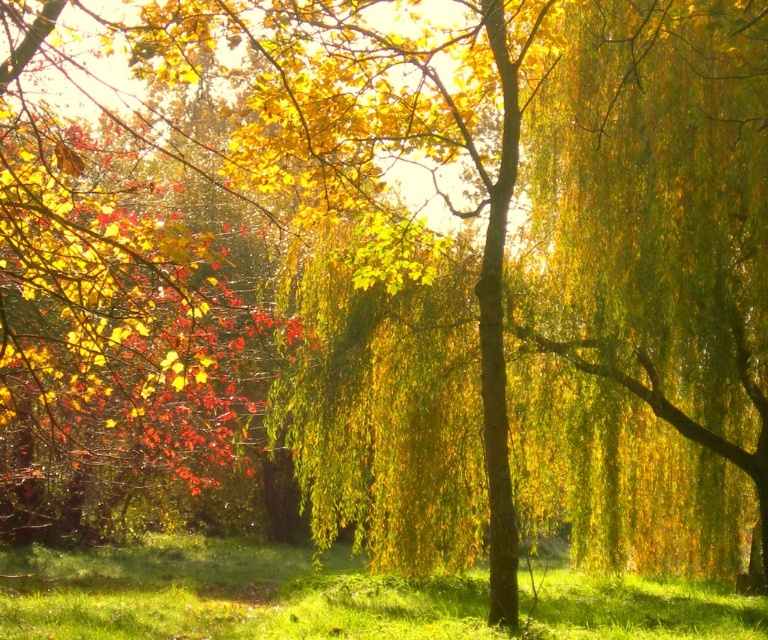
You are standing in the park scene described. There is a point marked at coordinates (666, 214). Which object in the scene does this point correspond to?

The point at coordinates (666, 214) corresponds to the golden silky willow at right.

You are standing in the park and want to take a photo of the golden silky willow at right and the green grass at lower center. Which object should you focus on first if you want both to be in sharp focus?

You should focus on the golden silky willow at right first because it is closer to the viewer than the green grass at lower center, so focusing on the closer object will ensure both are in focus.